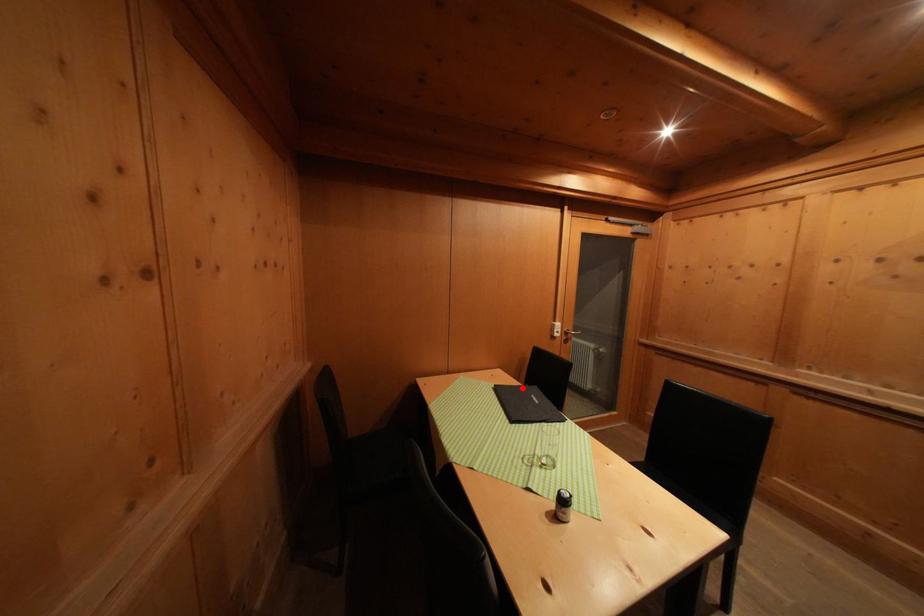
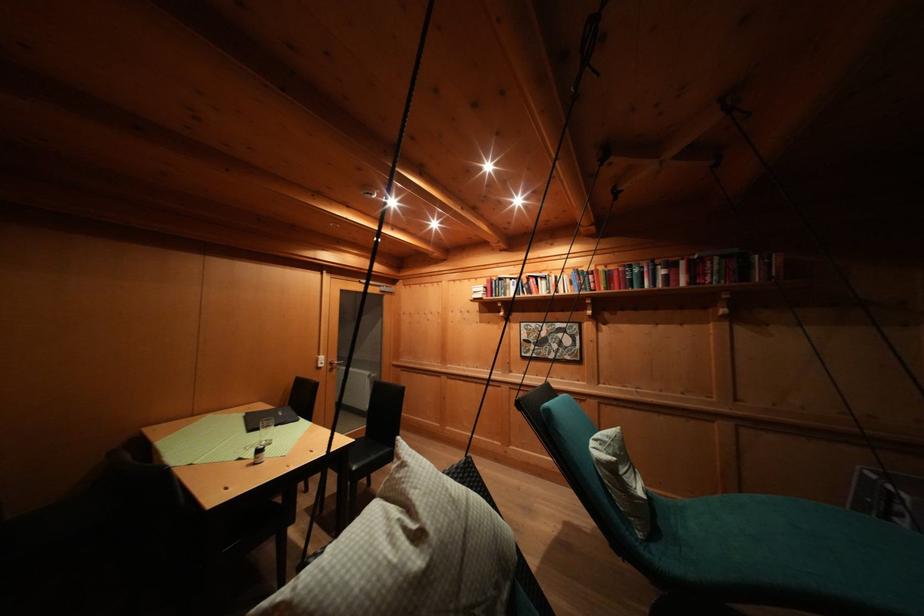
Locate, in the second image, the point that corresponds to the highlighted location in the first image.

(275, 411)